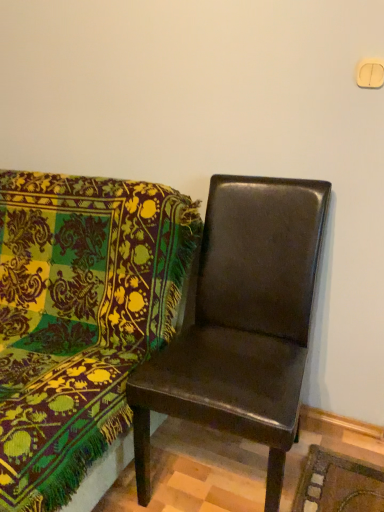
Question: Is leather-like dark brown chair at right, the second chair positioned from the right, wider than leather-like brown chair at center, which ranks as the first chair in right-to-left order?

Choices:
 (A) no
 (B) yes

Answer: (B)

Question: Can you confirm if leather-like dark brown chair at right, which is the first chair from left to right, is shorter than leather-like brown chair at center, marked as the 2th chair in a left-to-right arrangement?

Choices:
 (A) no
 (B) yes

Answer: (B)

Question: Is leather-like dark brown chair at right, the second chair positioned from the right, facing towards leather-like brown chair at center, which ranks as the first chair in right-to-left order?

Choices:
 (A) no
 (B) yes

Answer: (A)

Question: Is leather-like dark brown chair at right, the second chair positioned from the right, outside of leather-like brown chair at center, which ranks as the first chair in right-to-left order?

Choices:
 (A) no
 (B) yes

Answer: (B)

Question: Is leather-like dark brown chair at right, the second chair positioned from the right, positioned with its back to leather-like brown chair at center, which ranks as the first chair in right-to-left order?

Choices:
 (A) no
 (B) yes

Answer: (A)

Question: Considering the relative sizes of leather-like dark brown chair at right, the second chair positioned from the right, and leather-like brown chair at center, marked as the 2th chair in a left-to-right arrangement, in the image provided, is leather-like dark brown chair at right, the second chair positioned from the right, smaller than leather-like brown chair at center, marked as the 2th chair in a left-to-right arrangement,?

Choices:
 (A) yes
 (B) no

Answer: (B)

Question: Is leather-like brown chair at center, marked as the 2th chair in a left-to-right arrangement, bigger than leather-like dark brown chair at right, the second chair positioned from the right?

Choices:
 (A) yes
 (B) no

Answer: (B)

Question: From the image's perspective, is leather-like brown chair at center, which ranks as the first chair in right-to-left order, located above leather-like dark brown chair at right, which is the first chair from left to right?

Choices:
 (A) yes
 (B) no

Answer: (B)

Question: Is leather-like brown chair at center, marked as the 2th chair in a left-to-right arrangement, completely or partially outside of leather-like dark brown chair at right, which is the first chair from left to right?

Choices:
 (A) yes
 (B) no

Answer: (A)

Question: Does leather-like brown chair at center, marked as the 2th chair in a left-to-right arrangement, contain leather-like dark brown chair at right, which is the first chair from left to right?

Choices:
 (A) no
 (B) yes

Answer: (A)

Question: Is leather-like brown chair at center, which ranks as the first chair in right-to-left order, in front of leather-like dark brown chair at right, the second chair positioned from the right?

Choices:
 (A) no
 (B) yes

Answer: (A)

Question: Considering the relative positions of leather-like brown chair at center, marked as the 2th chair in a left-to-right arrangement, and leather-like dark brown chair at right, which is the first chair from left to right, in the image provided, is leather-like brown chair at center, marked as the 2th chair in a left-to-right arrangement, to the left of leather-like dark brown chair at right, which is the first chair from left to right, from the viewer's perspective?

Choices:
 (A) yes
 (B) no

Answer: (B)

Question: From a real-world perspective, is leather-like brown chair at center, marked as the 2th chair in a left-to-right arrangement, above or below leather-like dark brown chair at right, which is the first chair from left to right?

Choices:
 (A) above
 (B) below

Answer: (A)